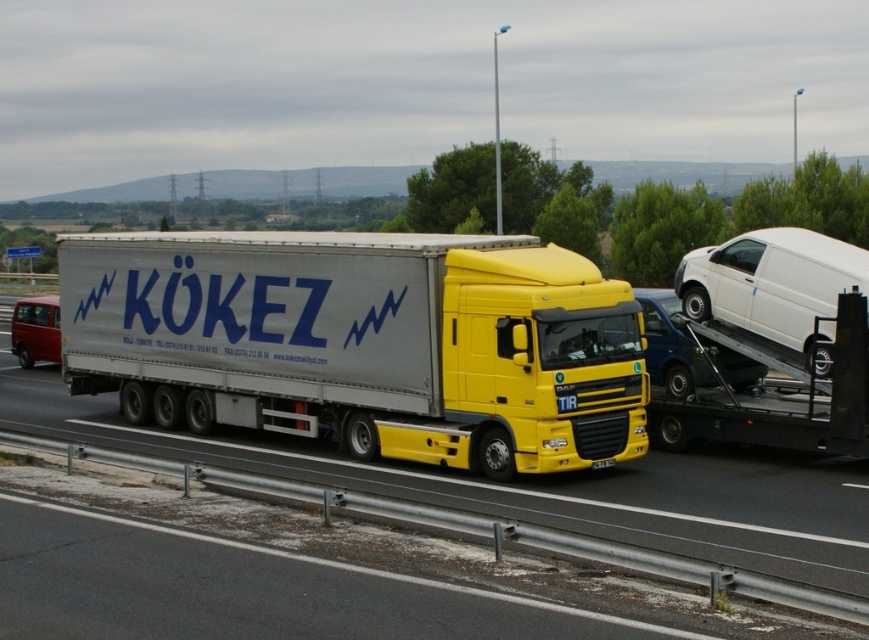
Question: Does metallic silver tow truck at right appear under white matte van at right?

Choices:
 (A) yes
 (B) no

Answer: (A)

Question: Among these objects, which one is farthest from the camera?

Choices:
 (A) white matte van at right
 (B) metallic red van at left
 (C) yellow metallic truck at center
 (D) silver metallic trailer at center

Answer: (B)

Question: Can you confirm if silver metallic trailer at center is thinner than white matte van at right?

Choices:
 (A) no
 (B) yes

Answer: (A)

Question: Which of the following is the closest to the observer?

Choices:
 (A) white matte van at right
 (B) metallic silver tow truck at right
 (C) silver metallic trailer at center
 (D) metallic red van at left

Answer: (C)

Question: Can you confirm if yellow metallic truck at center is positioned below metallic red van at left?

Choices:
 (A) yes
 (B) no

Answer: (A)

Question: Among these points, which one is farthest from the camera?

Choices:
 (A) (460, 260)
 (B) (850, 256)

Answer: (B)